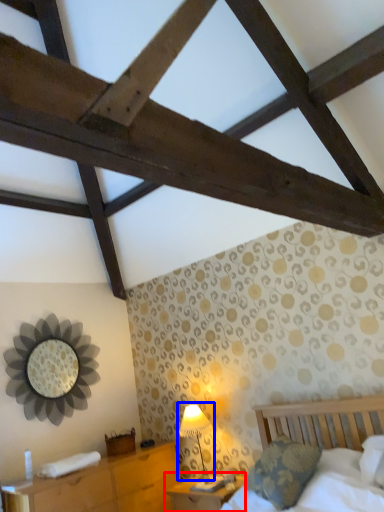
Question: Which object appears closest to the camera in this image, nightstand (highlighted by a red box) or table lamp (highlighted by a blue box)?

Choices:
 (A) nightstand
 (B) table lamp

Answer: (A)